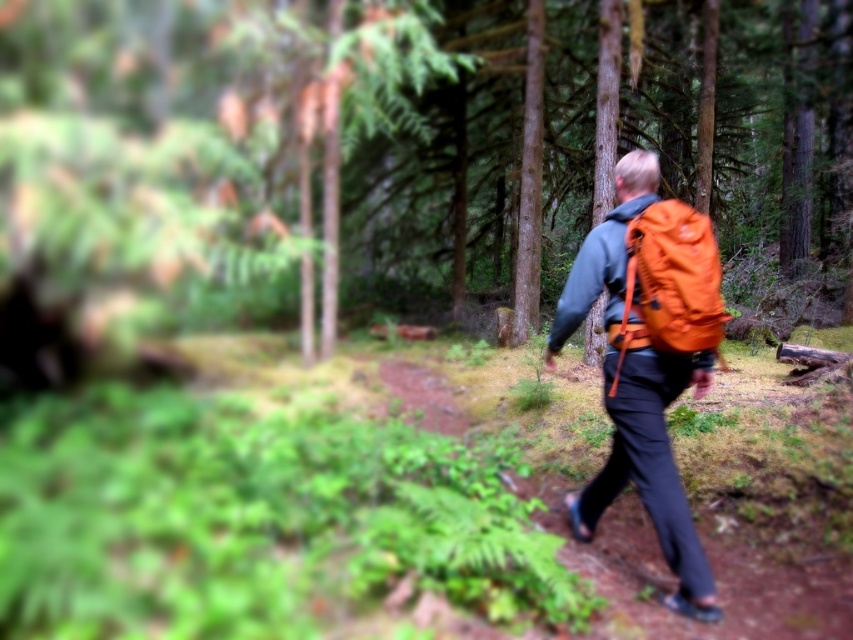
You are a hiker who needs to place a 10 meter long tent between the green matte tree at center and the orange fabric backpack at right. Is there enough space between them to set up the tent?

→ The distance between the green matte tree at center and the orange fabric backpack at right is 9.31 meters. Since the tent is 10 meters long, there isn not enough space to set up the tent between them.

You are a hiker who just arrived at the forest path. You see the orange fabric backpack at center. Where is the orange fabric backpack located in the scene?

The orange fabric backpack at center is located at point (x=717, y=580) in the scene.